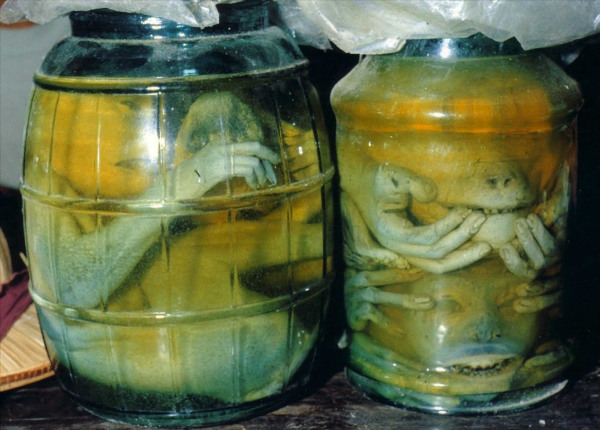
Locate an element on the screen. The height and width of the screenshot is (430, 600). jar is located at coordinates (430, 165).